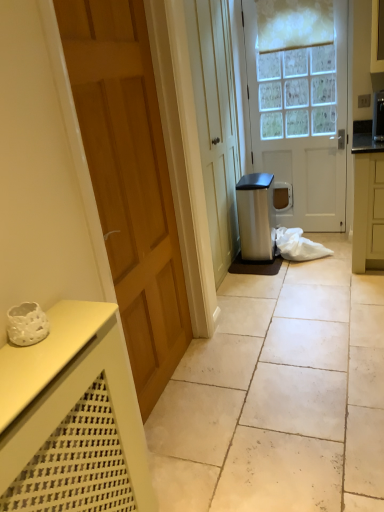
Question: Is wooden door at left, which is the second door in back-to-front order, inside white tile floor at center?

Choices:
 (A) no
 (B) yes

Answer: (A)

Question: Is white tile floor at center touching wooden door at left, which appears as the 1th door when viewed from the front?

Choices:
 (A) yes
 (B) no

Answer: (B)

Question: From the image's perspective, is white tile floor at center below wooden door at left, which ranks as the 1th door in left-to-right order?

Choices:
 (A) yes
 (B) no

Answer: (A)

Question: Considering the relative positions of white tile floor at center and wooden door at left, which ranks as the 1th door in left-to-right order, in the image provided, is white tile floor at center to the left of wooden door at left, which ranks as the 1th door in left-to-right order, from the viewer's perspective?

Choices:
 (A) no
 (B) yes

Answer: (A)

Question: Is white tile floor at center at the right side of wooden door at left, which is the second door in back-to-front order?

Choices:
 (A) yes
 (B) no

Answer: (A)

Question: From a real-world perspective, relative to white tile floor at center, is white fabric at center vertically above or below?

Choices:
 (A) below
 (B) above

Answer: (B)

Question: In terms of height, does white fabric at center look taller or shorter compared to white tile floor at center?

Choices:
 (A) tall
 (B) short

Answer: (A)

Question: Based on their sizes in the image, would you say white fabric at center is bigger or smaller than white tile floor at center?

Choices:
 (A) big
 (B) small

Answer: (B)

Question: Is white fabric at center spatially inside white tile floor at center, or outside of it?

Choices:
 (A) outside
 (B) inside

Answer: (A)

Question: Considering the positions of white tile floor at center and satin silver trash can at center-right in the image, is white tile floor at center bigger or smaller than satin silver trash can at center-right?

Choices:
 (A) big
 (B) small

Answer: (A)

Question: Which is correct: white tile floor at center is inside satin silver trash can at center-right, or outside of it?

Choices:
 (A) outside
 (B) inside

Answer: (A)

Question: Is white tile floor at center wider or thinner than satin silver trash can at center-right?

Choices:
 (A) wide
 (B) thin

Answer: (A)

Question: Considering their positions, is white tile floor at center located in front of or behind satin silver trash can at center-right?

Choices:
 (A) behind
 (B) front

Answer: (B)

Question: Is wooden door at left, which is the second door in back-to-front order, inside the boundaries of satin silver trash can at center-right, or outside?

Choices:
 (A) outside
 (B) inside

Answer: (A)

Question: From a real-world perspective, is wooden door at left, which appears as the 1th door when viewed from the front, above or below satin silver trash can at center-right?

Choices:
 (A) above
 (B) below

Answer: (A)